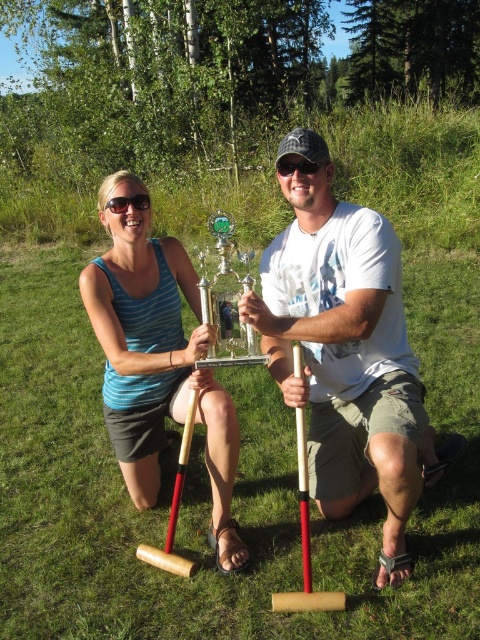
Does white cotton shirt at center appear on the left side of matte blue tank top at center?

Incorrect, white cotton shirt at center is not on the left side of matte blue tank top at center.

Does point (323, 220) come in front of point (164, 342)?

Yes, it is in front of point (164, 342).

Who is more forward, (359, 369) or (119, 330)?

Positioned in front is point (359, 369).

Locate an element on the screen. This screenshot has width=480, height=640. white cotton shirt at center is located at coordinates (343, 346).